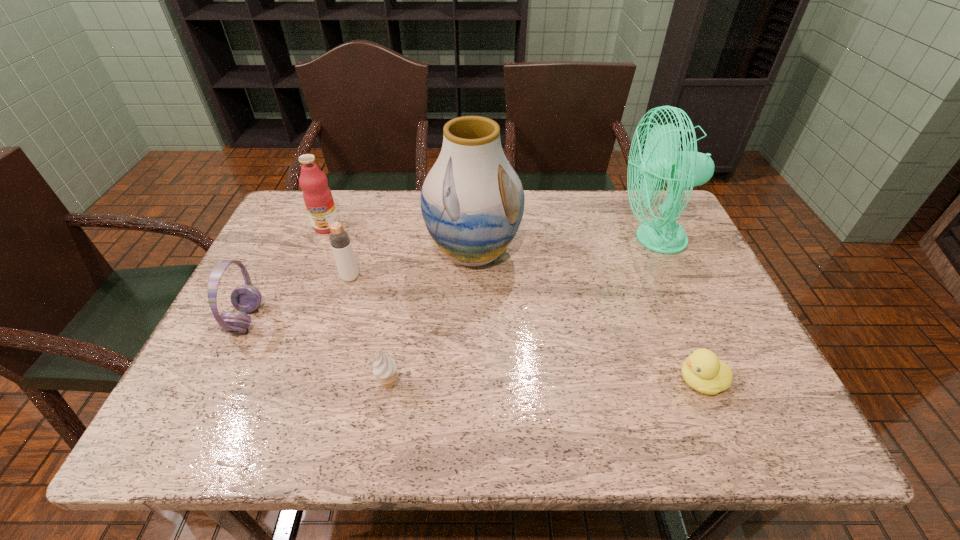
The image size is (960, 540). What are the coordinates of `free spot at the far edge of the desktop` in the screenshot? It's located at (344, 201).

Locate an element on the screen. The height and width of the screenshot is (540, 960). free space at the near edge of the desktop is located at coordinates (395, 413).

At what (x,y) coordinates should I click in order to perform the action: click on vacant space at the left edge. Please return your answer as a coordinate pair (x, y). Image resolution: width=960 pixels, height=540 pixels. Looking at the image, I should click on (310, 277).

This screenshot has height=540, width=960. What are the coordinates of `vacant space at the right edge of the desktop` in the screenshot? It's located at (768, 403).

Locate an element on the screen. Image resolution: width=960 pixels, height=540 pixels. vacant region at the near left corner of the desktop is located at coordinates (252, 429).

Identify the location of vacant space at the near right corner. This screenshot has height=540, width=960. (772, 406).

This screenshot has width=960, height=540. Find the location of `free space between the leftmost object and the fan`. free space between the leftmost object and the fan is located at coordinates pos(450,279).

Find the location of a particular element. The width and height of the screenshot is (960, 540). vacant space that's between the shortest object and the third nearest object is located at coordinates (473, 350).

The height and width of the screenshot is (540, 960). What are the coordinates of `free spot between the second shortest object and the third object from right to left` in the screenshot? It's located at (x=431, y=318).

Locate an element on the screen. vacant area that lies between the third object from right to left and the headset is located at coordinates (360, 286).